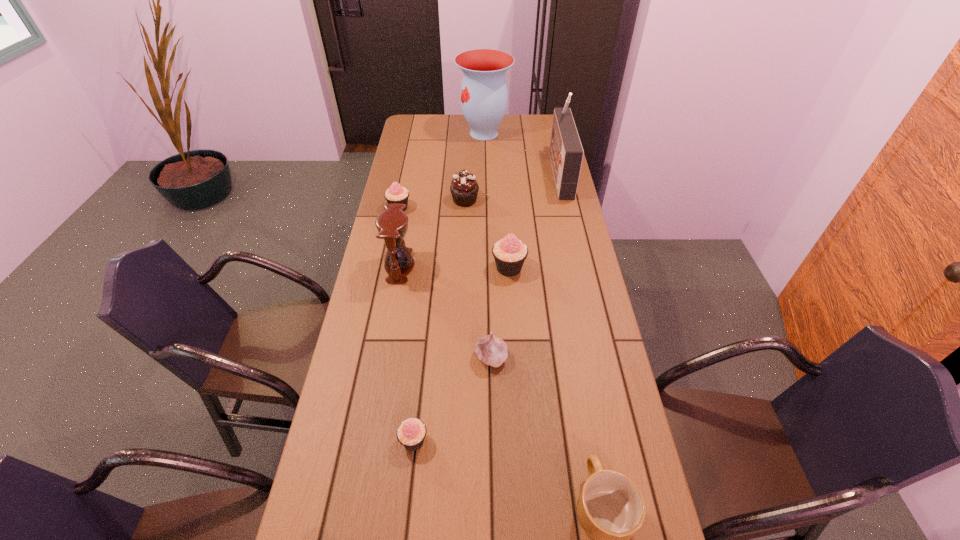
What are the coordinates of `the farthest object` in the screenshot? It's located at (484, 97).

Locate an element on the screen. red vase is located at coordinates pyautogui.click(x=484, y=97).

This screenshot has width=960, height=540. What are the coordinates of `radio receiver` in the screenshot? It's located at point(566,153).

You are a GUI agent. You are given a task and a screenshot of the screen. Output one action in this format:
    pyautogui.click(x=<x>, y=<y>)
    Task: Click on the brown hourglass
    
    Given the screenshot: What is the action you would take?
    pyautogui.click(x=392, y=224)

Where is `the seventh shortest object`? The width and height of the screenshot is (960, 540). the seventh shortest object is located at coordinates (392, 224).

You are a GUI agent. You are given a task and a screenshot of the screen. Output one action in this format:
    pyautogui.click(x=<x>, y=<y>)
    Task: Click on the biggest pink cupcake
    The image size is (960, 540).
    Given the screenshot: What is the action you would take?
    pyautogui.click(x=509, y=253)

The height and width of the screenshot is (540, 960). Find the location of `the tallest cupcake`. the tallest cupcake is located at coordinates coord(509,253).

The width and height of the screenshot is (960, 540). Find the location of `brown cupcake`. brown cupcake is located at coordinates (464, 189).

Image resolution: width=960 pixels, height=540 pixels. What are the coordinates of `the farthest pink cupcake` in the screenshot? It's located at (395, 194).

Locate an element on the screen. The image size is (960, 540). the leftmost pink cupcake is located at coordinates (395, 194).